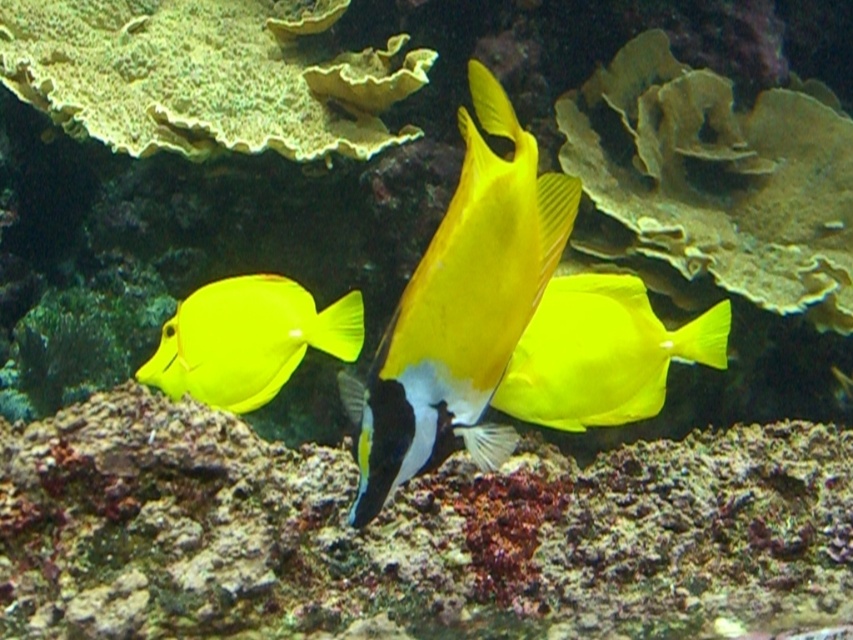
Which is above, yellow matte fish at center or matte yellow fish at center?

yellow matte fish at center

How distant is yellow matte fish at center from matte yellow fish at center?

yellow matte fish at center is 46.60 centimeters away from matte yellow fish at center.

Is point (459, 292) farther from camera compared to point (654, 333)?

No, it is in front of (654, 333).

Image resolution: width=853 pixels, height=640 pixels. I want to click on yellow matte fish at center, so click(x=460, y=310).

Who is positioned more to the right, matte yellow fish at center or matte yellow fish at left?

From the viewer's perspective, matte yellow fish at center appears more on the right side.

Can you confirm if matte yellow fish at center is thinner than matte yellow fish at left?

Yes, matte yellow fish at center is thinner than matte yellow fish at left.

Between point (640, 298) and point (267, 342), which one is positioned behind?

The point (267, 342) is more distant.

Locate an element on the screen. matte yellow fish at center is located at coordinates (601, 353).

Can you confirm if yellow matte fish at center is positioned above matte yellow fish at left?

Indeed, yellow matte fish at center is positioned over matte yellow fish at left.

Does yellow matte fish at center have a smaller size compared to matte yellow fish at left?

Actually, yellow matte fish at center might be larger than matte yellow fish at left.

Identify the location of yellow matte fish at center. The width and height of the screenshot is (853, 640). (460, 310).